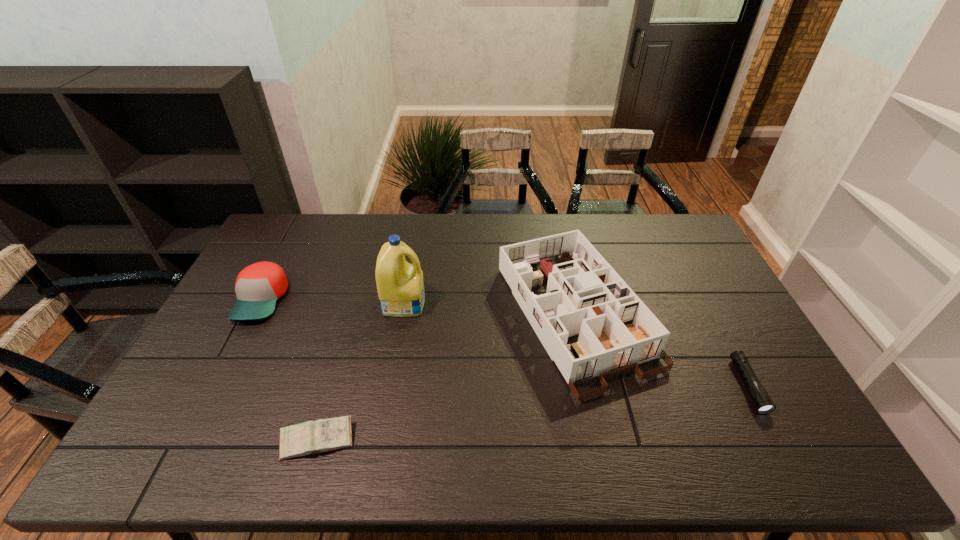
Where is `vacant region at the far right corner of the desktop`? vacant region at the far right corner of the desktop is located at coordinates (651, 225).

The image size is (960, 540). I want to click on free area in between the tallest object and the fourth object from left to right, so click(490, 308).

Identify the location of free space between the flashlight and the nearest object. This screenshot has height=540, width=960. (533, 413).

The image size is (960, 540). I want to click on vacant space that's between the diary and the dollhouse, so click(446, 377).

At what (x,y) coordinates should I click in order to perform the action: click on free space between the detergent and the nearest object. Please return your answer as a coordinate pair (x, y). Looking at the image, I should click on (361, 371).

Where is `free space between the nearest object and the flashlight`? The width and height of the screenshot is (960, 540). free space between the nearest object and the flashlight is located at coordinates (533, 413).

This screenshot has width=960, height=540. In order to click on empty space that is in between the detergent and the leftmost object in this screenshot , I will do `click(333, 301)`.

Where is `vacant space that's between the fourth tallest object and the leftmost object`? The image size is (960, 540). vacant space that's between the fourth tallest object and the leftmost object is located at coordinates point(289,370).

I want to click on free spot between the fourth object from left to right and the detergent, so click(490, 308).

The image size is (960, 540). In order to click on free space between the diary and the baseball cap in this screenshot , I will do `click(289, 370)`.